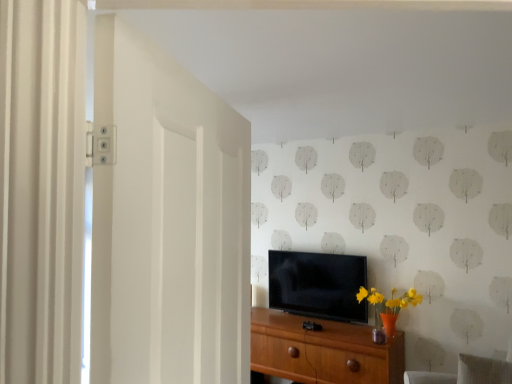
Question: Could you tell me if wooden chest of drawers at center is turned towards gray fabric swivel chair at lower right?

Choices:
 (A) no
 (B) yes

Answer: (A)

Question: Does wooden chest of drawers at center have a lesser width compared to gray fabric swivel chair at lower right?

Choices:
 (A) no
 (B) yes

Answer: (A)

Question: Considering the relative sizes of wooden chest of drawers at center and gray fabric swivel chair at lower right in the image provided, is wooden chest of drawers at center bigger than gray fabric swivel chair at lower right?

Choices:
 (A) yes
 (B) no

Answer: (A)

Question: Considering the relative sizes of wooden chest of drawers at center and gray fabric swivel chair at lower right in the image provided, is wooden chest of drawers at center shorter than gray fabric swivel chair at lower right?

Choices:
 (A) yes
 (B) no

Answer: (B)

Question: Is wooden chest of drawers at center outside gray fabric swivel chair at lower right?

Choices:
 (A) no
 (B) yes

Answer: (B)

Question: Would you say white matte door at left is inside or outside wooden chest of drawers at center?

Choices:
 (A) outside
 (B) inside

Answer: (A)

Question: From a real-world perspective, is white matte door at left positioned above or below wooden chest of drawers at center?

Choices:
 (A) above
 (B) below

Answer: (A)

Question: Is point (161, 230) closer or farther from the camera than point (391, 349)?

Choices:
 (A) closer
 (B) farther

Answer: (A)

Question: In the image, is white matte door at left positioned in front of or behind wooden chest of drawers at center?

Choices:
 (A) front
 (B) behind

Answer: (A)

Question: Based on their sizes in the image, would you say wooden chest of drawers at center is bigger or smaller than black glossy tv at center?

Choices:
 (A) small
 (B) big

Answer: (B)

Question: Considering the positions of wooden chest of drawers at center and black glossy tv at center in the image, is wooden chest of drawers at center wider or thinner than black glossy tv at center?

Choices:
 (A) thin
 (B) wide

Answer: (B)

Question: Considering the positions of wooden chest of drawers at center and black glossy tv at center in the image, is wooden chest of drawers at center taller or shorter than black glossy tv at center?

Choices:
 (A) short
 (B) tall

Answer: (B)

Question: In the image, is wooden chest of drawers at center positioned in front of or behind black glossy tv at center?

Choices:
 (A) behind
 (B) front

Answer: (B)

Question: Considering their positions, is gray fabric swivel chair at lower right located in front of or behind wooden chest of drawers at center?

Choices:
 (A) front
 (B) behind

Answer: (A)

Question: Would you say gray fabric swivel chair at lower right is to the left or to the right of wooden chest of drawers at center in the picture?

Choices:
 (A) left
 (B) right

Answer: (B)